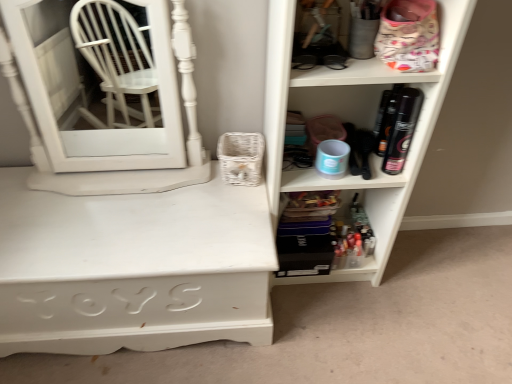
Locate an element on the screen. This screenshot has width=512, height=384. translucent plastic containers at lower center, marked as the 1th shelf in a bottom-to-top arrangement is located at coordinates 376,236.

This screenshot has width=512, height=384. I want to click on white painted wood desk at lower left, so click(x=133, y=268).

Can you see white glossy medicine cabinet at left touching matte white shelf at right, placed as the 1th shelf when sorted from top to bottom?

No, white glossy medicine cabinet at left is not beside matte white shelf at right, placed as the 1th shelf when sorted from top to bottom.

Considering the sizes of white glossy medicine cabinet at left and matte white shelf at right, which ranks as the 2th shelf in bottom-to-top order, in the image, is white glossy medicine cabinet at left taller or shorter than matte white shelf at right, which ranks as the 2th shelf in bottom-to-top order,?

white glossy medicine cabinet at left is shorter than matte white shelf at right, which ranks as the 2th shelf in bottom-to-top order.

Does white glossy medicine cabinet at left appear on the right side of matte white shelf at right, placed as the 1th shelf when sorted from top to bottom?

Incorrect, white glossy medicine cabinet at left is not on the right side of matte white shelf at right, placed as the 1th shelf when sorted from top to bottom.

Which is correct: white glossy medicine cabinet at left is inside matte white shelf at right, placed as the 1th shelf when sorted from top to bottom, or outside of it?

white glossy medicine cabinet at left is located beyond the bounds of matte white shelf at right, placed as the 1th shelf when sorted from top to bottom.

Choose the correct answer: Is matte white shelf at right, placed as the 1th shelf when sorted from top to bottom, inside white painted wood desk at lower left or outside it?

matte white shelf at right, placed as the 1th shelf when sorted from top to bottom, is spatially situated outside white painted wood desk at lower left.

In order to click on shelf that appears in front of the white painted wood desk at lower left in this screenshot , I will do `click(355, 122)`.

How many degrees apart are the facing directions of matte white shelf at right, placed as the 1th shelf when sorted from top to bottom, and white painted wood desk at lower left?

matte white shelf at right, placed as the 1th shelf when sorted from top to bottom, and white painted wood desk at lower left are facing 0.278 degrees away from each other.

Does matte white shelf at right, which ranks as the 2th shelf in bottom-to-top order, have a lesser width compared to white painted wood desk at lower left?

Correct, the width of matte white shelf at right, which ranks as the 2th shelf in bottom-to-top order, is less than that of white painted wood desk at lower left.

Can you confirm if translucent plastic containers at lower center, which is counted as the second shelf, starting from the top, is thinner than white painted wood desk at lower left?

Indeed, translucent plastic containers at lower center, which is counted as the second shelf, starting from the top, has a lesser width compared to white painted wood desk at lower left.

Is translucent plastic containers at lower center, marked as the 1th shelf in a bottom-to-top arrangement, in front of white painted wood desk at lower left?

That is False.

This screenshot has width=512, height=384. Find the location of `shelf below the white painted wood desk at lower left (from a real-world perspective)`. shelf below the white painted wood desk at lower left (from a real-world perspective) is located at coordinates (376, 236).

Is translucent plastic containers at lower center, marked as the 1th shelf in a bottom-to-top arrangement, positioned far away from white painted wood desk at lower left?

That's not correct — translucent plastic containers at lower center, marked as the 1th shelf in a bottom-to-top arrangement, is a little close to white painted wood desk at lower left.

Is translucent plastic containers at lower center, marked as the 1th shelf in a bottom-to-top arrangement, thinner than matte white shelf at right, placed as the 1th shelf when sorted from top to bottom?

Yes.

Is translucent plastic containers at lower center, marked as the 1th shelf in a bottom-to-top arrangement, turned away from matte white shelf at right, placed as the 1th shelf when sorted from top to bottom?

Yes, translucent plastic containers at lower center, marked as the 1th shelf in a bottom-to-top arrangement, is positioned with its back facing matte white shelf at right, placed as the 1th shelf when sorted from top to bottom.

Are translucent plastic containers at lower center, marked as the 1th shelf in a bottom-to-top arrangement, and matte white shelf at right, which ranks as the 2th shelf in bottom-to-top order, far apart?

translucent plastic containers at lower center, marked as the 1th shelf in a bottom-to-top arrangement, is actually quite close to matte white shelf at right, which ranks as the 2th shelf in bottom-to-top order.

How far apart are translucent plastic containers at lower center, marked as the 1th shelf in a bottom-to-top arrangement, and matte white shelf at right, placed as the 1th shelf when sorted from top to bottom?

7.03 inches.

Consider the image. Is white glossy medicine cabinet at left outside of white painted wood desk at lower left?

white glossy medicine cabinet at left is positioned outside white painted wood desk at lower left.

Can you confirm if white glossy medicine cabinet at left is shorter than white painted wood desk at lower left?

No, white glossy medicine cabinet at left is not shorter than white painted wood desk at lower left.

Is white glossy medicine cabinet at left looking in the opposite direction of white painted wood desk at lower left?

Result: white glossy medicine cabinet at left does not have its back to white painted wood desk at lower left.

From a real-world perspective, is translucent plastic containers at lower center, which is counted as the second shelf, starting from the top, below white glossy medicine cabinet at left?

Yes, from a real-world perspective, translucent plastic containers at lower center, which is counted as the second shelf, starting from the top, is below white glossy medicine cabinet at left.

Is translucent plastic containers at lower center, marked as the 1th shelf in a bottom-to-top arrangement, in contact with white glossy medicine cabinet at left?

No, translucent plastic containers at lower center, marked as the 1th shelf in a bottom-to-top arrangement, is not touching white glossy medicine cabinet at left.

From the image's perspective, is translucent plastic containers at lower center, which is counted as the second shelf, starting from the top, above or below white glossy medicine cabinet at left?

Clearly, from the image's perspective, translucent plastic containers at lower center, which is counted as the second shelf, starting from the top, is below white glossy medicine cabinet at left.

Identify the location of medicine cabinet above the translucent plastic containers at lower center, which is counted as the second shelf, starting from the top (from a real-world perspective). The height and width of the screenshot is (384, 512). (111, 128).

Which of these two, white glossy medicine cabinet at left or translucent plastic containers at lower center, which is counted as the second shelf, starting from the top, is wider?

Wider between the two is white glossy medicine cabinet at left.

Is white glossy medicine cabinet at left aimed at translucent plastic containers at lower center, marked as the 1th shelf in a bottom-to-top arrangement?

No, white glossy medicine cabinet at left is not aimed at translucent plastic containers at lower center, marked as the 1th shelf in a bottom-to-top arrangement.

At what (x,y) coordinates should I click in order to perform the action: click on medicine cabinet on the left of translucent plastic containers at lower center, marked as the 1th shelf in a bottom-to-top arrangement. Please return your answer as a coordinate pair (x, y). The width and height of the screenshot is (512, 384). Looking at the image, I should click on (111, 128).

The height and width of the screenshot is (384, 512). Identify the location of the 1st shelf below the white glossy medicine cabinet at left (from a real-world perspective). (355, 122).

The height and width of the screenshot is (384, 512). Identify the location of shelf that appears above the white painted wood desk at lower left (from a real-world perspective). (355, 122).

Considering their positions, is white glossy medicine cabinet at left positioned further to translucent plastic containers at lower center, marked as the 1th shelf in a bottom-to-top arrangement, than matte white shelf at right, which ranks as the 2th shelf in bottom-to-top order?

white glossy medicine cabinet at left.

When comparing their distances from white painted wood desk at lower left, does translucent plastic containers at lower center, which is counted as the second shelf, starting from the top, or matte white shelf at right, placed as the 1th shelf when sorted from top to bottom, seem further?

translucent plastic containers at lower center, which is counted as the second shelf, starting from the top, is positioned further to the anchor white painted wood desk at lower left.

When comparing their distances from white painted wood desk at lower left, does matte white shelf at right, which ranks as the 2th shelf in bottom-to-top order, or translucent plastic containers at lower center, marked as the 1th shelf in a bottom-to-top arrangement, seem closer?

Based on the image, matte white shelf at right, which ranks as the 2th shelf in bottom-to-top order, appears to be nearer to white painted wood desk at lower left.

Looking at the image, which one is located further to white painted wood desk at lower left, white glossy medicine cabinet at left or matte white shelf at right, placed as the 1th shelf when sorted from top to bottom?

matte white shelf at right, placed as the 1th shelf when sorted from top to bottom, is positioned further to the anchor white painted wood desk at lower left.

Looking at the image, which one is located further to matte white shelf at right, which ranks as the 2th shelf in bottom-to-top order, translucent plastic containers at lower center, marked as the 1th shelf in a bottom-to-top arrangement, or white glossy medicine cabinet at left?

white glossy medicine cabinet at left lies further to matte white shelf at right, which ranks as the 2th shelf in bottom-to-top order, than the other object.

From the picture: Which object lies nearer to the anchor point translucent plastic containers at lower center, marked as the 1th shelf in a bottom-to-top arrangement, matte white shelf at right, which ranks as the 2th shelf in bottom-to-top order, or white glossy medicine cabinet at left?

matte white shelf at right, which ranks as the 2th shelf in bottom-to-top order, lies closer to translucent plastic containers at lower center, marked as the 1th shelf in a bottom-to-top arrangement, than the other object.

When comparing their distances from white glossy medicine cabinet at left, does matte white shelf at right, which ranks as the 2th shelf in bottom-to-top order, or white painted wood desk at lower left seem further?

Among the two, matte white shelf at right, which ranks as the 2th shelf in bottom-to-top order, is located further to white glossy medicine cabinet at left.

Considering their positions, is white glossy medicine cabinet at left positioned closer to matte white shelf at right, which ranks as the 2th shelf in bottom-to-top order, than white painted wood desk at lower left?

Among the two, white painted wood desk at lower left is located nearer to matte white shelf at right, which ranks as the 2th shelf in bottom-to-top order.

What are the coordinates of `desk between white glossy medicine cabinet at left and matte white shelf at right, placed as the 1th shelf when sorted from top to bottom, from left to right` in the screenshot? It's located at (133, 268).

Find the location of `desk between white glossy medicine cabinet at left and translucent plastic containers at lower center, which is counted as the second shelf, starting from the top, from left to right`. desk between white glossy medicine cabinet at left and translucent plastic containers at lower center, which is counted as the second shelf, starting from the top, from left to right is located at coordinates (133, 268).

This screenshot has width=512, height=384. I want to click on shelf between white painted wood desk at lower left and matte white shelf at right, placed as the 1th shelf when sorted from top to bottom, in the horizontal direction, so click(x=376, y=236).

The image size is (512, 384). What are the coordinates of `shelf situated between white glossy medicine cabinet at left and matte white shelf at right, which ranks as the 2th shelf in bottom-to-top order, from left to right` in the screenshot? It's located at (376, 236).